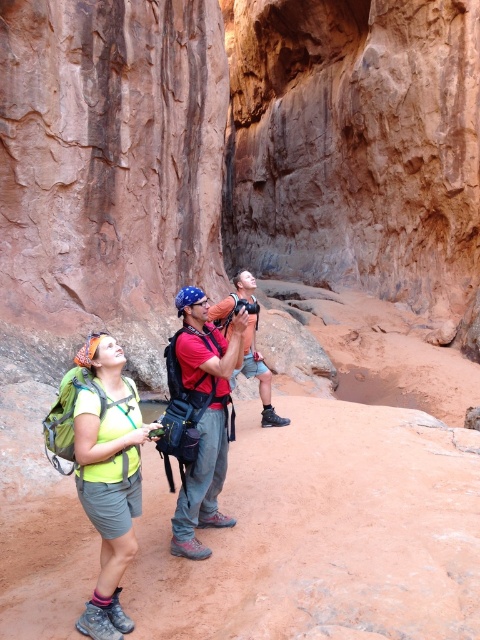
Is neon green fabric backpack at lower left positioned in front of matte orange tank top at center?

Yes, neon green fabric backpack at lower left is closer to the viewer.

Which is behind, point (105, 586) or point (252, 332)?

Positioned behind is point (252, 332).

Locate an element on the screen. neon green fabric backpack at lower left is located at coordinates (108, 477).

Does matte red shirt at center have a smaller size compared to matte orange tank top at center?

Indeed, matte red shirt at center has a smaller size compared to matte orange tank top at center.

Is matte red shirt at center to the right of matte orange tank top at center from the viewer's perspective?

Yes, matte red shirt at center is to the right of matte orange tank top at center.

I want to click on matte red shirt at center, so click(204, 417).

Who is more distant from viewer, (118, 368) or (213, 481)?

Positioned behind is point (213, 481).

Is neon green fabric backpack at lower left to the left of matte red shirt at center from the viewer's perspective?

Correct, you'll find neon green fabric backpack at lower left to the left of matte red shirt at center.

What do you see at coordinates (108, 477) in the screenshot? This screenshot has width=480, height=640. I see `neon green fabric backpack at lower left` at bounding box center [108, 477].

I want to click on neon green fabric backpack at lower left, so click(108, 477).